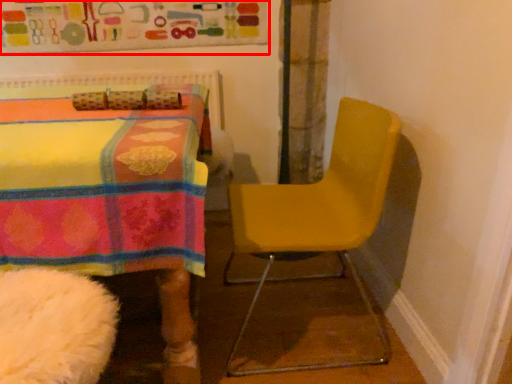
Question: From the image's perspective, where is bulletin board (annotated by the red box) located relative to chair?

Choices:
 (A) above
 (B) below

Answer: (A)